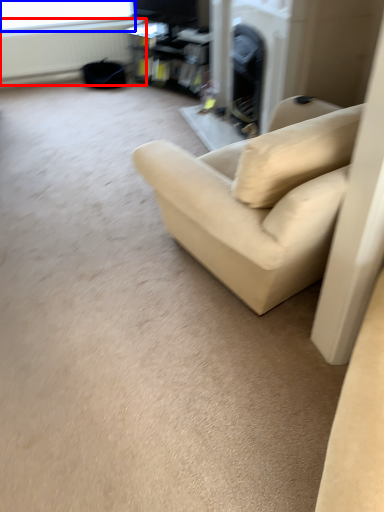
Question: Which object appears farthest to the camera in this image, radiator (highlighted by a red box) or window screen (highlighted by a blue box)?

Choices:
 (A) radiator
 (B) window screen

Answer: (A)